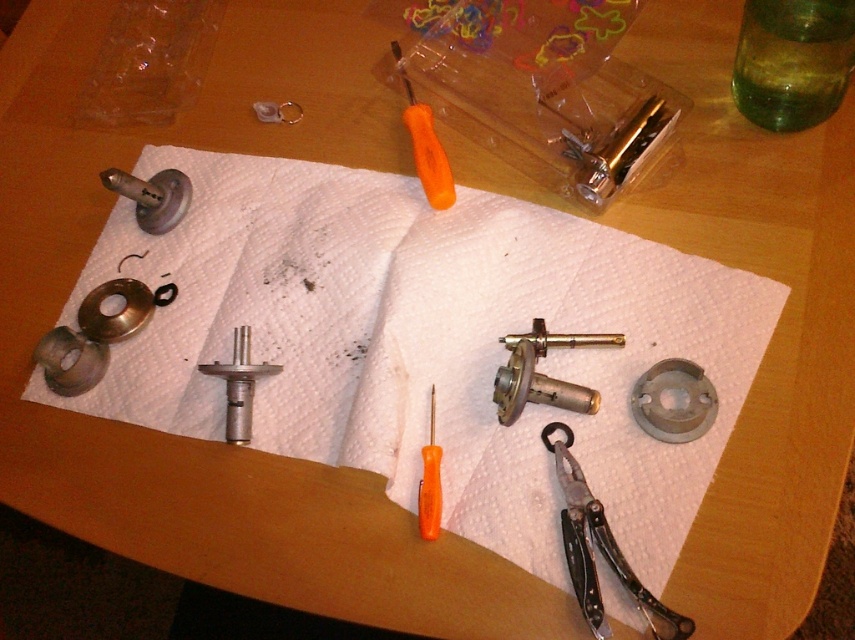
You are organizing the tools on the workspace. The metallic silver cylinder at center and the metallic gold razor at upper center are both on the white paper towel. Which object is positioned to the left of the other?

The metallic silver cylinder at center is to the left of the metallic gold razor at upper center according to the description.

You are organizing tools on a workbench and notice the metallic silver cylinder at center and the metallic gold razor at upper center. Which object is shorter in height?

The metallic silver cylinder at center has a lesser height compared to the metallic gold razor at upper center, so the metallic silver cylinder at center is shorter.